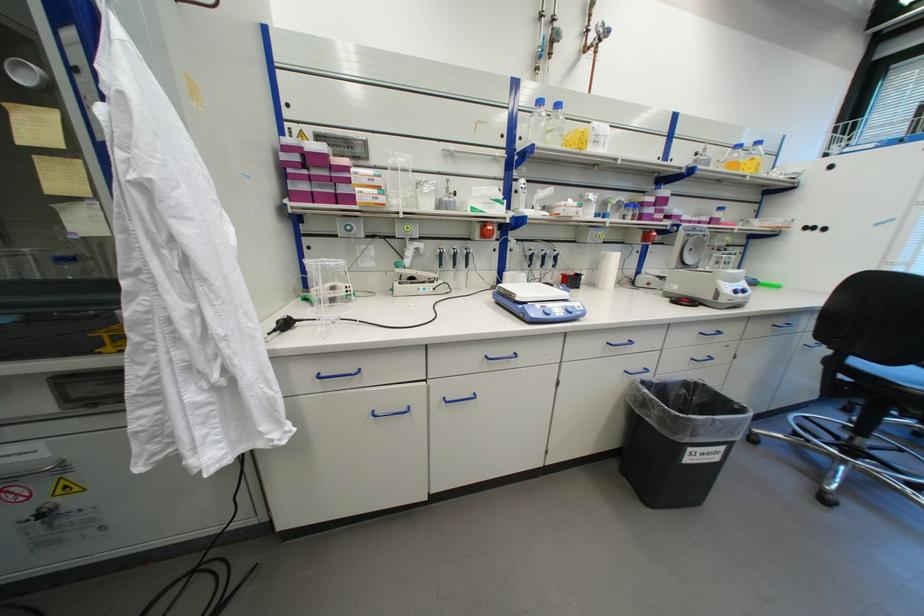
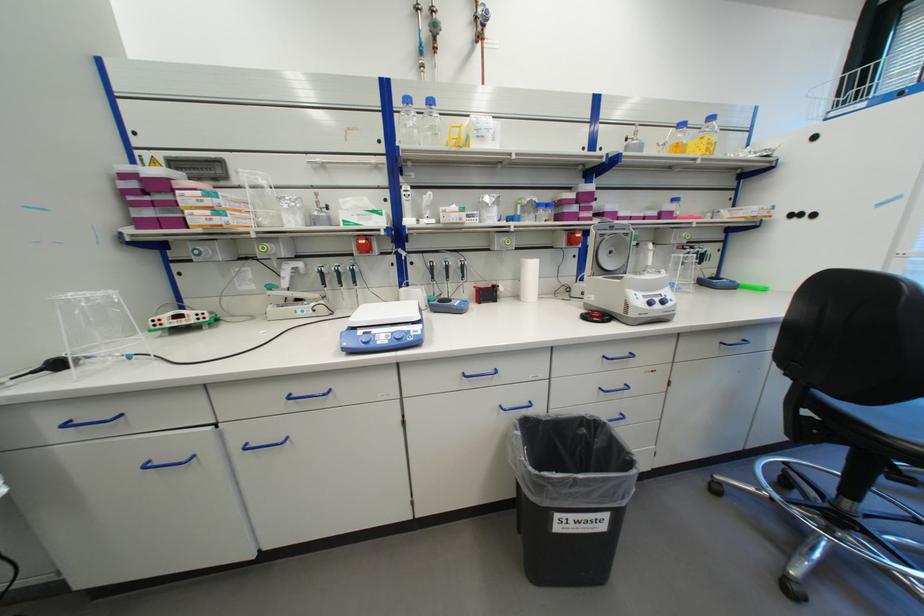
The point at (383,192) is marked in the first image. Where is the corresponding point in the second image?

(215, 213)